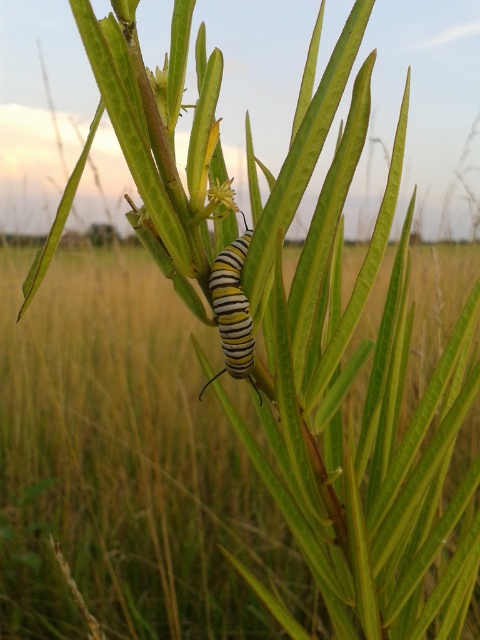
Does yellow striped caterpillar at center have a lesser height compared to green matte leaf at center?

→ No, yellow striped caterpillar at center is not shorter than green matte leaf at center.

Is point (228, 285) farther from camera compared to point (212, 218)?

No, it is not.

Is point (235, 244) behind point (218, 209)?

Yes, it is behind point (218, 209).

What are the coordinates of `yellow striped caterpillar at center` in the screenshot? It's located at (232, 310).

From the picture: Is yellow striped caterpillar at center bigger than yellow-green textured flower at upper center?

Correct, yellow striped caterpillar at center is larger in size than yellow-green textured flower at upper center.

Between point (223, 262) and point (168, 61), which one is positioned in front?

Point (168, 61) is more forward.

The width and height of the screenshot is (480, 640). Identify the location of yellow striped caterpillar at center. (232, 310).

Image resolution: width=480 pixels, height=640 pixels. What are the coordinates of `yellow-green textured flower at upper center` in the screenshot? It's located at (167, 93).

Does yellow-green textured flower at upper center have a greater height compared to green matte leaf at center?

Indeed, yellow-green textured flower at upper center has a greater height compared to green matte leaf at center.

Is point (160, 72) positioned after point (220, 204)?

Yes, point (160, 72) is behind point (220, 204).

You are a GUI agent. You are given a task and a screenshot of the screen. Output one action in this format:
    pyautogui.click(x=<x>, y=<y>)
    Task: Click on the yellow-green textured flower at upper center
    This screenshot has width=480, height=640.
    Given the screenshot: What is the action you would take?
    pyautogui.click(x=167, y=93)